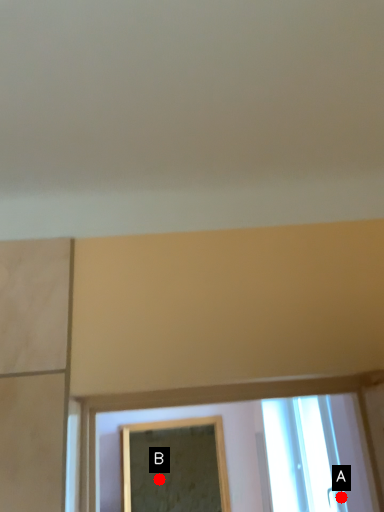
Question: Two points are circled on the image, labeled by A and B beside each circle. Which point is farther from the camera taking this photo?

Choices:
 (A) A is further
 (B) B is further

Answer: (B)